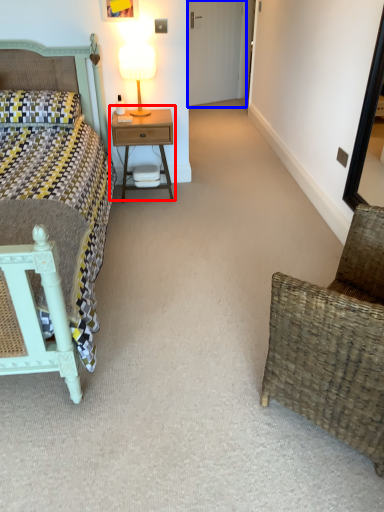
Question: Which object is closer to the camera taking this photo, nightstand (highlighted by a red box) or glass door (highlighted by a blue box)?

Choices:
 (A) nightstand
 (B) glass door

Answer: (A)